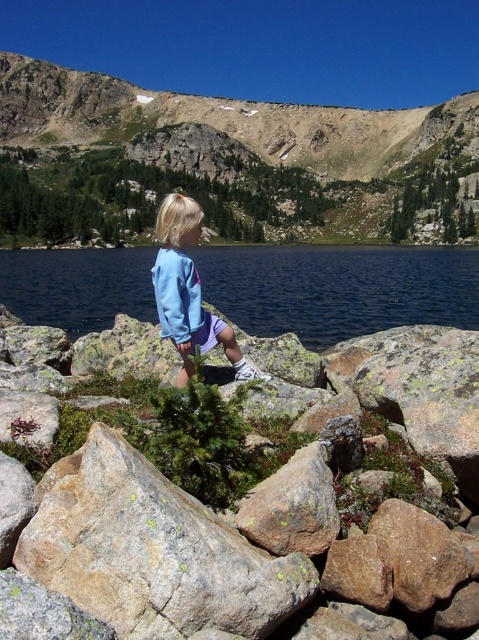
Question: Among these objects, which one is farthest from the camera?

Choices:
 (A) blue fabric lake at center
 (B) brown rough rock at center
 (C) light blue fleece jacket at center

Answer: (A)

Question: Can you confirm if rugged brown rock at upper center is positioned to the right of light blue fleece jacket at center?

Choices:
 (A) yes
 (B) no

Answer: (B)

Question: Which point is closer to the camera taking this photo?

Choices:
 (A) (185, 376)
 (B) (407, 298)

Answer: (A)

Question: Can you confirm if blue fabric lake at center is positioned to the right of light blue fleece jacket at center?

Choices:
 (A) yes
 (B) no

Answer: (A)

Question: In this image, where is brown rough rock at center located relative to blue fabric lake at center?

Choices:
 (A) right
 (B) left

Answer: (B)

Question: Estimate the real-world distances between objects in this image. Which object is farther from the blue fabric lake at center?

Choices:
 (A) light blue fleece jacket at center
 (B) rugged brown rock at upper center

Answer: (B)